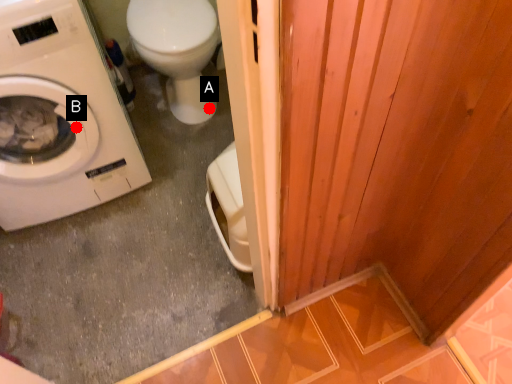
Question: Two points are circled on the image, labeled by A and B beside each circle. Which point is further to the camera?

Choices:
 (A) A is further
 (B) B is further

Answer: (A)